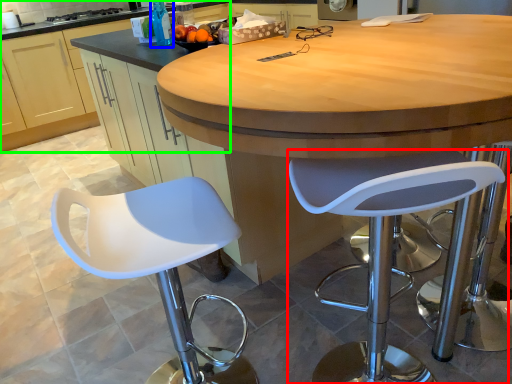
Question: Which object is the closest to the chair (highlighted by a red box)? Choose among these: bottle (highlighted by a blue box) or cabinetry (highlighted by a green box).

Choices:
 (A) bottle
 (B) cabinetry

Answer: (A)